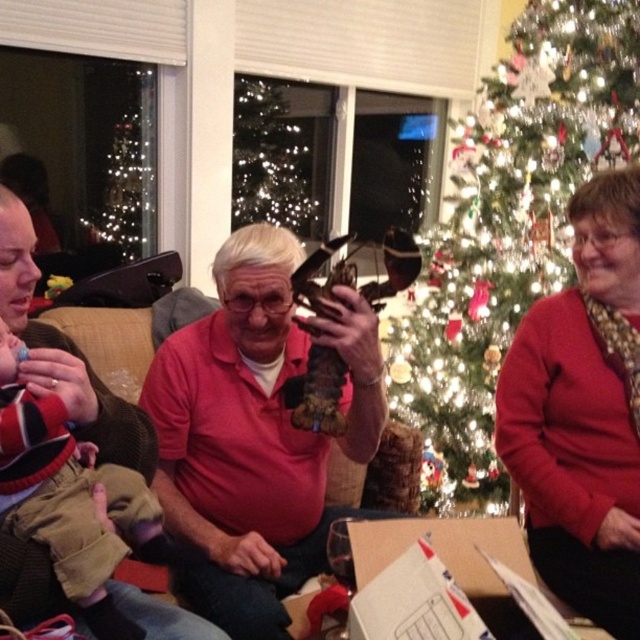
You are standing in the living room and want to place a gift under the Christmas tree. The gift needs to be placed near the red sweater at right. Where should you put the gift?

The red sweater at right is located at point (582, 412), so you should place the gift near that coordinate under the Christmas tree.